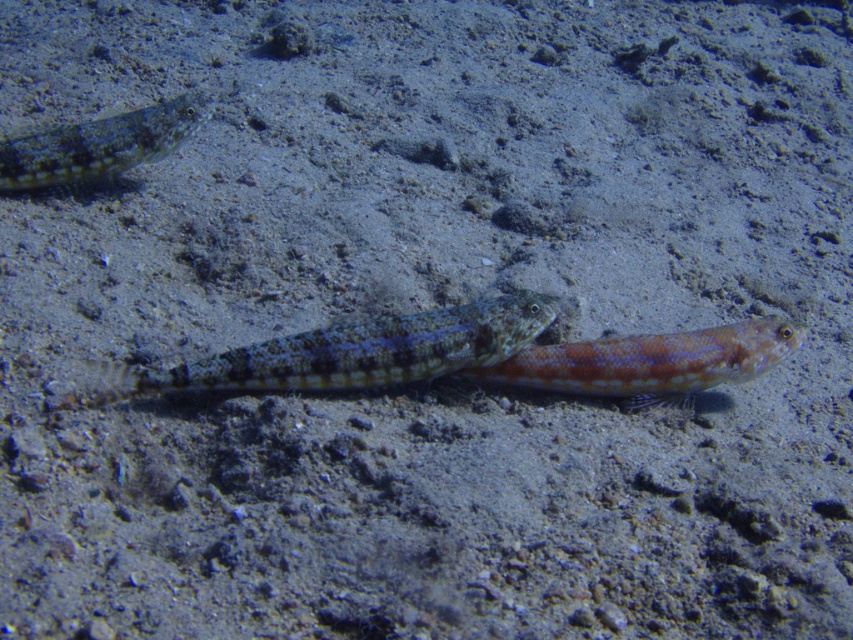
You are a marine biologist observing this underwater scene. You notice the shiny orange fish at center and the speckled skin fish at upper left. Which fish is positioned lower in the frame?

The shiny orange fish at center is positioned lower than the speckled skin fish at upper left.

You are a scuba diver swimming towards the speckled sand eel at center and the speckled skin fish at upper left. Which fish will you reach first?

You will reach the speckled sand eel at center first because it is closer to you than the speckled skin fish at upper left.